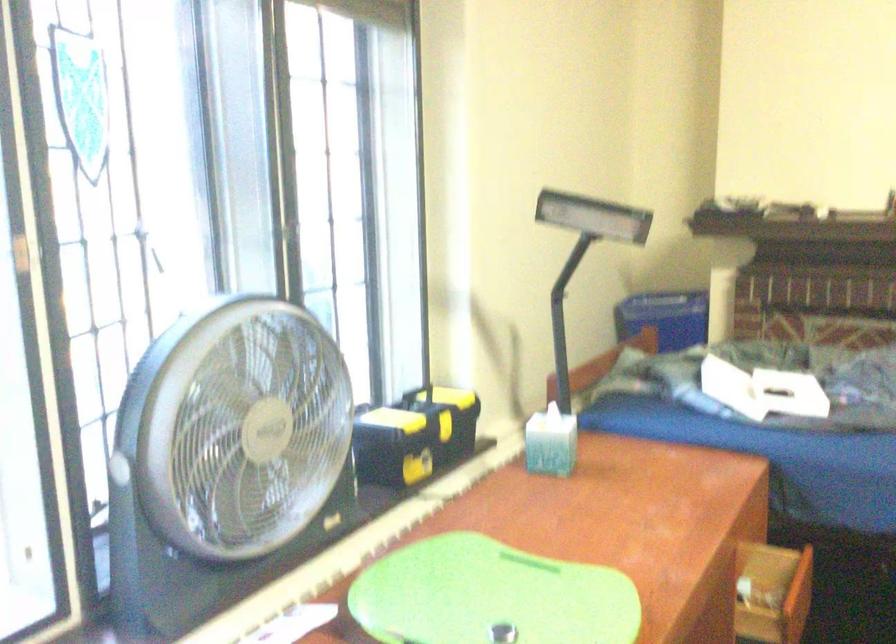
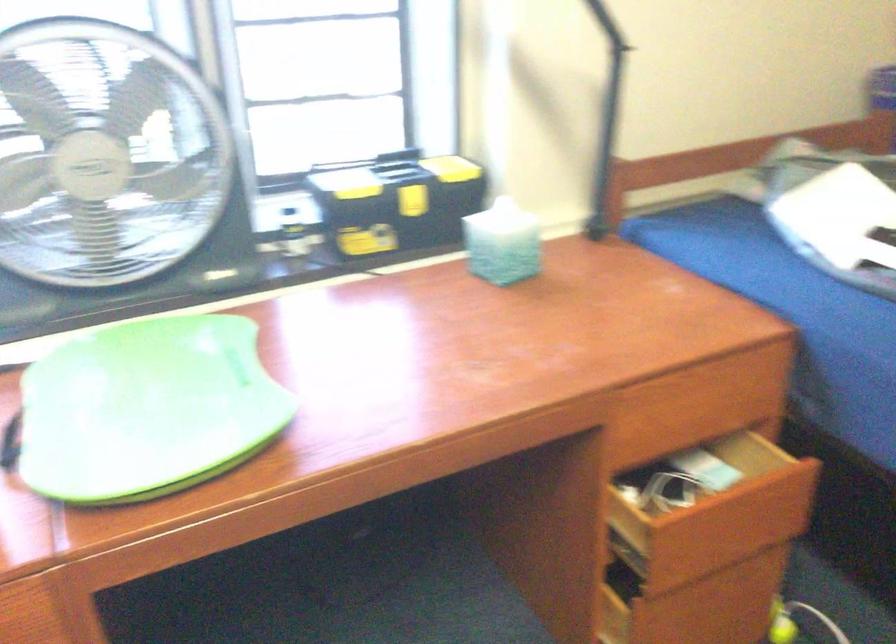
Where in the second image is the point corresponding to the point at 552,447 from the first image?

(503, 243)